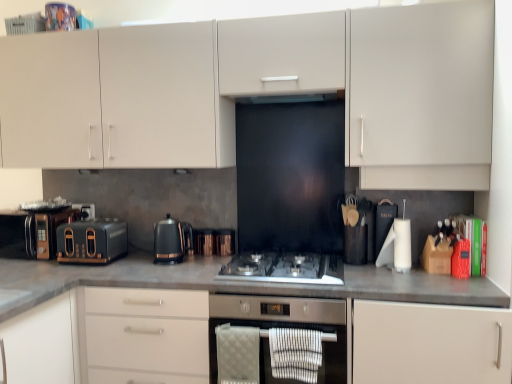
Find the location of a particular element. The image size is (512, 384). black metallic kettle at center, which appears as the 1th kitchen appliance when viewed from the right is located at coordinates (170, 240).

Describe the element at coordinates (51, 230) in the screenshot. I see `matte black toaster at left, arranged as the third appliance when viewed from the right` at that location.

Find the location of a particular element. The image size is (512, 384). matte black toaster at left, placed as the 1th appliance when sorted from left to right is located at coordinates (51, 230).

Locate an element on the screen. This screenshot has height=384, width=512. matte white cabinet at upper center, which appears as the 2th cabinetry when ordered from the bottom is located at coordinates pos(267,92).

The width and height of the screenshot is (512, 384). Describe the element at coordinates (85, 210) in the screenshot. I see `black metallic toaster at left, the 2th appliance positioned from the right` at that location.

What is the approximate width of metallic copper kettle at center, which is the third appliance in left-to-right order?

It is 3.14 inches.

Image resolution: width=512 pixels, height=384 pixels. Find the location of `black matte exhaust hood at center`. black matte exhaust hood at center is located at coordinates (291, 98).

Does matte white cabinet at center, which is the first cabinetry from bottom to top, appear on the left side of matte black toaster at left, placed as the 1th appliance when sorted from left to right?

In fact, matte white cabinet at center, which is the first cabinetry from bottom to top, is to the right of matte black toaster at left, placed as the 1th appliance when sorted from left to right.

Could you tell me if matte white cabinet at center, which is the 2th cabinetry in top-to-bottom order, is turned towards matte black toaster at left, arranged as the third appliance when viewed from the right?

No, matte white cabinet at center, which is the 2th cabinetry in top-to-bottom order, is not turned towards matte black toaster at left, arranged as the third appliance when viewed from the right.

Measure the distance from matte white cabinet at center, which is the 2th cabinetry in top-to-bottom order, to matte black toaster at left, placed as the 1th appliance when sorted from left to right.

matte white cabinet at center, which is the 2th cabinetry in top-to-bottom order, and matte black toaster at left, placed as the 1th appliance when sorted from left to right, are 35.63 inches apart.

Considering the points (25, 353) and (49, 249), which point is behind, point (25, 353) or point (49, 249)?

The point (49, 249) is more distant.

Is matte white cabinet at center, which is the first cabinetry from bottom to top, wider or thinner than black metallic kettle at center, which ranks as the 2th kitchen appliance in left-to-right order?

In the image, matte white cabinet at center, which is the first cabinetry from bottom to top, appears to be wider than black metallic kettle at center, which ranks as the 2th kitchen appliance in left-to-right order.

Is matte white cabinet at center, which is the 2th cabinetry in top-to-bottom order, facing away from black metallic kettle at center, which appears as the 1th kitchen appliance when viewed from the right?

matte white cabinet at center, which is the 2th cabinetry in top-to-bottom order, is not turned away from black metallic kettle at center, which appears as the 1th kitchen appliance when viewed from the right.

Would you say matte white cabinet at center, which is the 2th cabinetry in top-to-bottom order, is a long distance from black metallic kettle at center, which ranks as the 2th kitchen appliance in left-to-right order?

No, matte white cabinet at center, which is the 2th cabinetry in top-to-bottom order, is not far away from black metallic kettle at center, which ranks as the 2th kitchen appliance in left-to-right order.

From a real-world perspective, relative to matte white cabinet at upper center, which appears as the 2th cabinetry when ordered from the bottom, is black metallic toaster at left, the 2th appliance positioned from the right, vertically above or below?

black metallic toaster at left, the 2th appliance positioned from the right, is situated lower than matte white cabinet at upper center, which appears as the 2th cabinetry when ordered from the bottom, in the real world.

Can you confirm if black metallic toaster at left, the 2th appliance viewed from the left, is wider than matte white cabinet at upper center, which appears as the 2th cabinetry when ordered from the bottom?

No.

Can you tell me how much black metallic toaster at left, the 2th appliance positioned from the right, and matte white cabinet at upper center, which ranks as the 1th cabinetry in top-to-bottom order, differ in facing direction?

They differ by 1.42 degrees in their facing directions.

Is point (92, 213) farther from viewer compared to point (283, 19)?

Yes, point (92, 213) is farther from viewer.

From a real-world perspective, between black matte exhaust hood at center and matte black toaster at left, placed as the second kitchen appliance when sorted from right to left, who is vertically lower?

matte black toaster at left, placed as the second kitchen appliance when sorted from right to left, is physically lower.

Is black matte exhaust hood at center not inside matte black toaster at left, positioned as the first kitchen appliance in left-to-right order?

Yes, black matte exhaust hood at center is outside of matte black toaster at left, positioned as the first kitchen appliance in left-to-right order.

Based on the photo, is black matte exhaust hood at center aimed at matte black toaster at left, positioned as the first kitchen appliance in left-to-right order?

No, black matte exhaust hood at center is not oriented towards matte black toaster at left, positioned as the first kitchen appliance in left-to-right order.

Does point (275, 103) come closer to viewer compared to point (116, 246)?

No, (275, 103) is behind (116, 246).

How much distance is there between matte white cabinet at center, which is the first cabinetry from bottom to top, and matte black toaster at left, placed as the second kitchen appliance when sorted from right to left?

matte white cabinet at center, which is the first cabinetry from bottom to top, is 21.91 inches away from matte black toaster at left, placed as the second kitchen appliance when sorted from right to left.

Consider the image. Between matte white cabinet at center, which is the 2th cabinetry in top-to-bottom order, and matte black toaster at left, placed as the second kitchen appliance when sorted from right to left, which one is positioned behind?

matte black toaster at left, placed as the second kitchen appliance when sorted from right to left, is further from the camera.

In the scene shown: Would you consider matte white cabinet at center, which is the 2th cabinetry in top-to-bottom order, to be distant from matte black toaster at left, placed as the second kitchen appliance when sorted from right to left?

No, matte white cabinet at center, which is the 2th cabinetry in top-to-bottom order, is not far from matte black toaster at left, placed as the second kitchen appliance when sorted from right to left.

From the image's perspective, which is below, matte white cabinet at center, which is the 2th cabinetry in top-to-bottom order, or matte black toaster at left, placed as the second kitchen appliance when sorted from right to left?

matte white cabinet at center, which is the 2th cabinetry in top-to-bottom order, is shown below in the image.

Considering the relative sizes of matte black toaster at left, arranged as the third appliance when viewed from the right, and black metallic kettle at center, which appears as the 1th kitchen appliance when viewed from the right, in the image provided, is matte black toaster at left, arranged as the third appliance when viewed from the right, smaller than black metallic kettle at center, which appears as the 1th kitchen appliance when viewed from the right,?

Incorrect, matte black toaster at left, arranged as the third appliance when viewed from the right, is not smaller in size than black metallic kettle at center, which appears as the 1th kitchen appliance when viewed from the right.

Is matte black toaster at left, placed as the 1th appliance when sorted from left to right, at the right side of black metallic kettle at center, which appears as the 1th kitchen appliance when viewed from the right?

In fact, matte black toaster at left, placed as the 1th appliance when sorted from left to right, is to the left of black metallic kettle at center, which appears as the 1th kitchen appliance when viewed from the right.

Is matte black toaster at left, arranged as the third appliance when viewed from the right, facing away from black metallic kettle at center, which ranks as the 2th kitchen appliance in left-to-right order?

No, matte black toaster at left, arranged as the third appliance when viewed from the right,'s orientation is not away from black metallic kettle at center, which ranks as the 2th kitchen appliance in left-to-right order.

Which is behind, black metallic toaster at left, the 2th appliance viewed from the left, or matte white cabinet at center, which is the first cabinetry from bottom to top?

black metallic toaster at left, the 2th appliance viewed from the left.

Which object is thinner, black metallic toaster at left, the 2th appliance positioned from the right, or matte white cabinet at center, which is the first cabinetry from bottom to top?

black metallic toaster at left, the 2th appliance positioned from the right, is thinner.

Considering the relative positions of black metallic toaster at left, the 2th appliance positioned from the right, and matte white cabinet at center, which is the first cabinetry from bottom to top, in the image provided, is black metallic toaster at left, the 2th appliance positioned from the right, to the left of matte white cabinet at center, which is the first cabinetry from bottom to top, from the viewer's perspective?

Correct, you'll find black metallic toaster at left, the 2th appliance positioned from the right, to the left of matte white cabinet at center, which is the first cabinetry from bottom to top.

Locate an element on the screen. appliance that is the 2nd one when counting leftward from the matte white cabinet at center, which is the first cabinetry from bottom to top is located at coordinates (51, 230).

From a real-world perspective, starting from the matte white cabinet at center, which is the first cabinetry from bottom to top, which kitchen appliance is the 2nd one vertically above it? Please provide its 2D coordinates.

[(170, 240)]

Considering their positions, is black metallic toaster at left, the 2th appliance positioned from the right, positioned further to matte black toaster at left, placed as the 1th appliance when sorted from left to right, than stainless steel gas stove at center?

stainless steel gas stove at center is positioned further to the anchor matte black toaster at left, placed as the 1th appliance when sorted from left to right.

Estimate the real-world distances between objects in this image. Which object is further from matte white cabinet at upper center, which appears as the 2th cabinetry when ordered from the bottom, black metallic toaster at left, the 2th appliance viewed from the left, or matte black toaster at left, placed as the 1th appliance when sorted from left to right?

black metallic toaster at left, the 2th appliance viewed from the left, is positioned further to the anchor matte white cabinet at upper center, which appears as the 2th cabinetry when ordered from the bottom.

From the image, which object appears to be farther from stainless steel oven at center, black metallic toaster at left, the 2th appliance viewed from the left, or matte white cabinet at upper center, which appears as the 2th cabinetry when ordered from the bottom?

black metallic toaster at left, the 2th appliance viewed from the left, lies further to stainless steel oven at center than the other object.

Which object lies nearer to the anchor point matte white cabinet at upper center, which appears as the 2th cabinetry when ordered from the bottom, matte white cabinet at center, which is the 2th cabinetry in top-to-bottom order, or matte black toaster at left, positioned as the first kitchen appliance in left-to-right order?

Based on the image, matte black toaster at left, positioned as the first kitchen appliance in left-to-right order, appears to be nearer to matte white cabinet at upper center, which appears as the 2th cabinetry when ordered from the bottom.

Based on their spatial positions, is matte white cabinet at upper center, which ranks as the 1th cabinetry in top-to-bottom order, or matte black toaster at left, positioned as the first kitchen appliance in left-to-right order, further from stainless steel oven at center?

matte white cabinet at upper center, which ranks as the 1th cabinetry in top-to-bottom order, lies further to stainless steel oven at center than the other object.

Which object lies nearer to the anchor point stainless steel gas stove at center, matte white cabinet at center, which is the 2th cabinetry in top-to-bottom order, or matte white cabinet at upper center, which ranks as the 1th cabinetry in top-to-bottom order?

Based on the image, matte white cabinet at center, which is the 2th cabinetry in top-to-bottom order, appears to be nearer to stainless steel gas stove at center.

When comparing their distances from stainless steel gas stove at center, does black metallic kettle at center, which ranks as the 2th kitchen appliance in left-to-right order, or matte black toaster at left, positioned as the first kitchen appliance in left-to-right order, seem further?

The object further to stainless steel gas stove at center is matte black toaster at left, positioned as the first kitchen appliance in left-to-right order.

Estimate the real-world distances between objects in this image. Which object is closer to matte white cabinet at upper center, which appears as the 2th cabinetry when ordered from the bottom, matte white cabinet at center, which is the first cabinetry from bottom to top, or stainless steel gas stove at center?

stainless steel gas stove at center lies closer to matte white cabinet at upper center, which appears as the 2th cabinetry when ordered from the bottom, than the other object.

At what (x,y) coordinates should I click in order to perform the action: click on gas stove between black matte exhaust hood at center and matte white cabinet at center, which is the 2th cabinetry in top-to-bottom order, vertically. Please return your answer as a coordinate pair (x, y). Looking at the image, I should click on (285, 268).

This screenshot has width=512, height=384. In order to click on appliance between matte black toaster at left, placed as the second kitchen appliance when sorted from right to left, and black matte exhaust hood at center from left to right in this screenshot , I will do `click(225, 242)`.

Identify the location of exhaust hood between matte white cabinet at center, which is the first cabinetry from bottom to top, and matte black toaster at left, placed as the second kitchen appliance when sorted from right to left, from front to back. (291, 98).

The image size is (512, 384). Identify the location of home appliance positioned between matte white cabinet at center, which is the first cabinetry from bottom to top, and stainless steel gas stove at center from near to far. (285, 325).